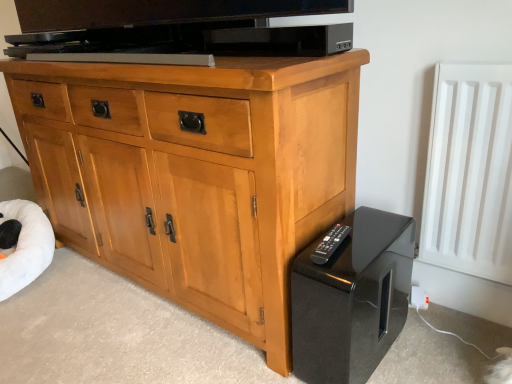
I want to click on white matte radiator at right, so click(469, 172).

Locate an element on the screen. black plastic remote at lower right is located at coordinates (330, 244).

This screenshot has width=512, height=384. Describe the element at coordinates (330, 244) in the screenshot. I see `black plastic remote at lower right` at that location.

Locate an element on the screen. white matte radiator at right is located at coordinates (469, 172).

Considering the points (321, 263) and (471, 231), which point is in front, point (321, 263) or point (471, 231)?

The point (321, 263) is in front.

Is white matte radiator at right at the back of black plastic remote at lower right?

No, black plastic remote at lower right is not facing away from white matte radiator at right.

In terms of height, does black plastic remote at lower right look taller or shorter compared to white matte radiator at right?

Considering their sizes, black plastic remote at lower right has less height than white matte radiator at right.

From a real-world perspective, which object rests below the other?

From a 3D spatial view, white plush bean bag at lower left is below.

Measure the distance between white plush bean bag at lower left and black plastic remote at lower right.

white plush bean bag at lower left is 1.22 meters from black plastic remote at lower right.

Can you tell me how much white plush bean bag at lower left and black plastic remote at lower right differ in facing direction?

The angular difference between white plush bean bag at lower left and black plastic remote at lower right is 50.2 degrees.

Which is less distant, (39, 264) or (333, 229)?

Point (333, 229)

From a real-world perspective, is black glossy speaker at lower right positioned above or below white plush bean bag at lower left?

From a real-world perspective, black glossy speaker at lower right is physically above white plush bean bag at lower left.

How much distance is there between black glossy speaker at lower right and white plush bean bag at lower left?

1.21 meters.

From the image's perspective, relative to white plush bean bag at lower left, is black glossy speaker at lower right above or below?

Based on their image positions, black glossy speaker at lower right is located beneath white plush bean bag at lower left.

Between white plush bean bag at lower left and white matte radiator at right, which one has smaller width?

white matte radiator at right is thinner.

What's the angular difference between white plush bean bag at lower left and white matte radiator at right's facing directions?

58.5 degrees.

Which point is more forward, (30,238) or (496,128)?

The point (496,128) is more forward.

Considering the sizes of white plush bean bag at lower left and white matte radiator at right in the image, is white plush bean bag at lower left bigger or smaller than white matte radiator at right?

In the image, white plush bean bag at lower left appears to be larger than white matte radiator at right.

The image size is (512, 384). I want to click on remote positioned vertically above the white plush bean bag at lower left (from a real-world perspective), so click(x=330, y=244).

Could you tell me if black plastic remote at lower right is facing white plush bean bag at lower left?

No, black plastic remote at lower right is not facing towards white plush bean bag at lower left.

How many degrees apart are the facing directions of black plastic remote at lower right and white plush bean bag at lower left?

50.2 degrees.

Is point (331, 249) farther from camera compared to point (42, 249)?

No, it is not.

Does light wood cabinet at center have a lesser height compared to black plastic remote at lower right?

In fact, light wood cabinet at center may be taller than black plastic remote at lower right.

Considering the relative sizes of light wood cabinet at center and black plastic remote at lower right in the image provided, is light wood cabinet at center wider than black plastic remote at lower right?

Correct, the width of light wood cabinet at center exceeds that of black plastic remote at lower right.

From a real-world perspective, relative to black plastic remote at lower right, is light wood cabinet at center vertically above or below?

light wood cabinet at center is above black plastic remote at lower right.

Is light wood cabinet at center oriented away from black plastic remote at lower right?

No, light wood cabinet at center is not facing away from black plastic remote at lower right.

Do you think black glossy speaker at lower right is within black plastic remote at lower right, or outside of it?

black glossy speaker at lower right is spatially situated outside black plastic remote at lower right.

This screenshot has height=384, width=512. I want to click on remote above the black glossy speaker at lower right (from the image's perspective), so click(x=330, y=244).

From the image's perspective, which is below, black glossy speaker at lower right or black plastic remote at lower right?

black glossy speaker at lower right.

Find the location of a particular element. Image resolution: width=512 pixels, height=384 pixels. remote that appears in front of the white matte radiator at right is located at coordinates (330, 244).

Find the location of a particular element. The width and height of the screenshot is (512, 384). bean bag chair directly beneath the black plastic remote at lower right (from a real-world perspective) is located at coordinates (26, 246).

From the image, which object appears to be farther from white matte radiator at right, light wood cabinet at center or white plush bean bag at lower left?

white plush bean bag at lower left.

Considering their positions, is white matte radiator at right positioned closer to black plastic remote at lower right than black glossy speaker at lower right?

Based on the image, black glossy speaker at lower right appears to be nearer to black plastic remote at lower right.

Considering their positions, is white matte radiator at right positioned further to light wood cabinet at center than black plastic remote at lower right?

The object further to light wood cabinet at center is white matte radiator at right.

Consider the image. From the image, which object appears to be farther from white matte radiator at right, white plush bean bag at lower left or light wood cabinet at center?

Based on the image, white plush bean bag at lower left appears to be further to white matte radiator at right.

Considering their positions, is white matte radiator at right positioned further to light wood cabinet at center than black glossy speaker at lower right?

white matte radiator at right lies further to light wood cabinet at center than the other object.

When comparing their distances from white plush bean bag at lower left, does black glossy speaker at lower right or white matte radiator at right seem further?

white matte radiator at right is positioned further to the anchor white plush bean bag at lower left.

When comparing their distances from black glossy speaker at lower right, does black plastic remote at lower right or white plush bean bag at lower left seem closer?

Based on the image, black plastic remote at lower right appears to be nearer to black glossy speaker at lower right.

When comparing their distances from black plastic remote at lower right, does black glossy speaker at lower right or white plush bean bag at lower left seem closer?

black glossy speaker at lower right lies closer to black plastic remote at lower right than the other object.

Where is `the chest of drawers located between white plush bean bag at lower left and black glossy speaker at lower right in the left-right direction`? The image size is (512, 384). the chest of drawers located between white plush bean bag at lower left and black glossy speaker at lower right in the left-right direction is located at coordinates click(196, 174).

Locate an element on the screen. chest of drawers between white plush bean bag at lower left and black plastic remote at lower right from left to right is located at coordinates (196, 174).

Locate an element on the screen. This screenshot has width=512, height=384. remote between light wood cabinet at center and black glossy speaker at lower right in the horizontal direction is located at coordinates tap(330, 244).

What are the coordinates of `home appliance between black plastic remote at lower right and white matte radiator at right from left to right` in the screenshot? It's located at (352, 299).